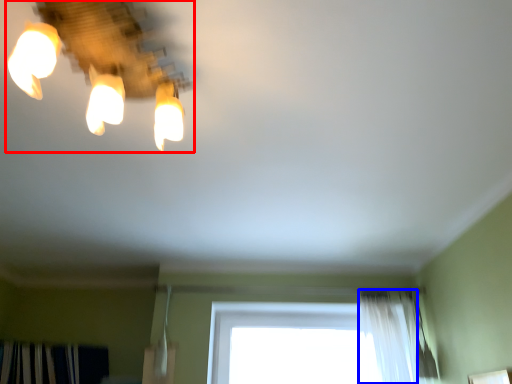
Question: Which point is closer to the camera, lamp (highlighted by a red box) or shower curtain (highlighted by a blue box)?

Choices:
 (A) lamp
 (B) shower curtain

Answer: (A)